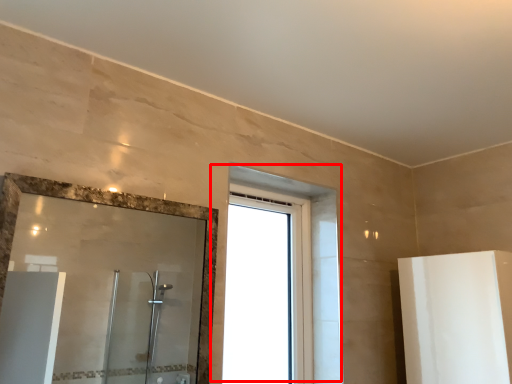
Question: From the image's perspective, considering the relative positions of window (annotated by the red box) and mirror in the image provided, where is window (annotated by the red box) located with respect to the staircase?

Choices:
 (A) below
 (B) above

Answer: (A)